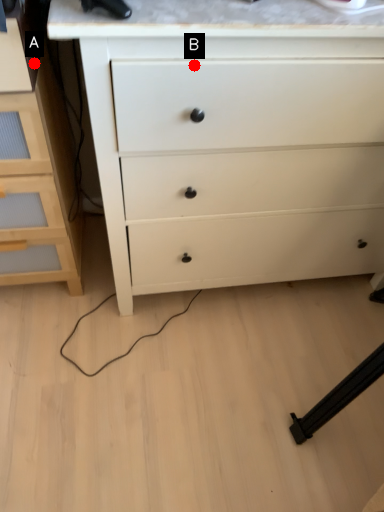
Question: Two points are circled on the image, labeled by A and B beside each circle. Which point is further to the camera?

Choices:
 (A) A is further
 (B) B is further

Answer: (A)